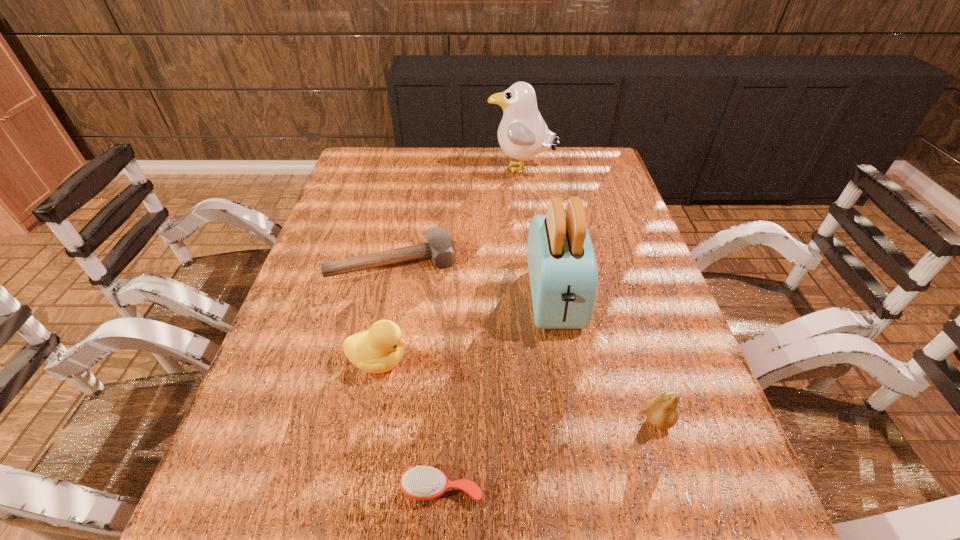
Find the location of a particular element. gull is located at coordinates (522, 134).

The image size is (960, 540). What are the coordinates of `toaster` in the screenshot? It's located at (563, 272).

Identify the location of the fourth farthest object. This screenshot has width=960, height=540. (377, 350).

Where is `pear`? This screenshot has height=540, width=960. pear is located at coordinates (662, 411).

The width and height of the screenshot is (960, 540). In order to click on the fifth farthest object in this screenshot , I will do `click(662, 411)`.

Where is `the fifth tallest object`? the fifth tallest object is located at coordinates (439, 246).

In order to click on the nearest object in this screenshot , I will do `click(419, 482)`.

Image resolution: width=960 pixels, height=540 pixels. Find the location of `hairbrush`. hairbrush is located at coordinates (419, 482).

Find the location of a particular element. The width and height of the screenshot is (960, 540). free point located on the beak of the gull is located at coordinates (404, 170).

Locate an element on the screen. The width and height of the screenshot is (960, 540). free space located 0.210m on the beak of the gull is located at coordinates (424, 170).